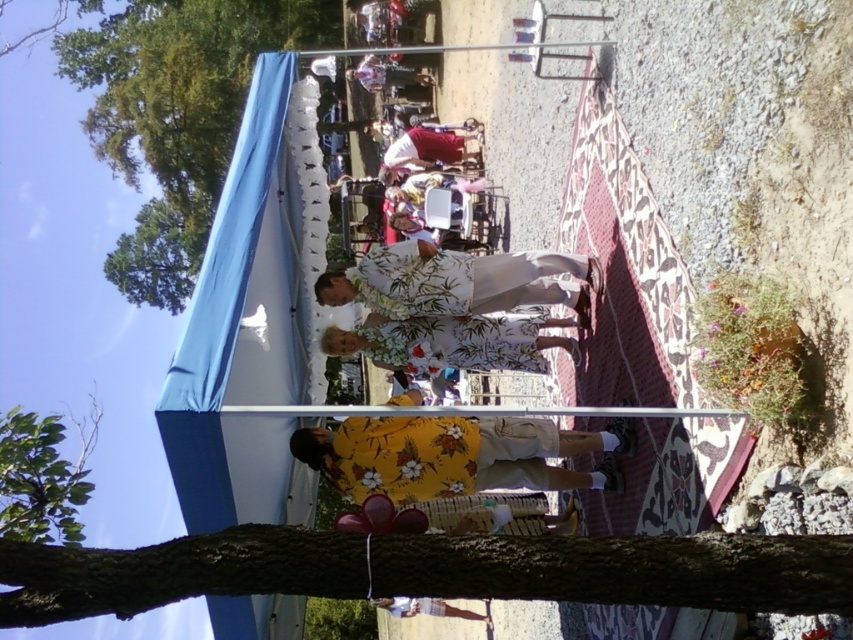
Is floral fabric robe at center to the right of green leafy tree at lower left from the viewer's perspective?

Yes, floral fabric robe at center is to the right of green leafy tree at lower left.

In the scene shown: Does floral fabric robe at center appear under green leafy tree at lower left?

No.

Is point (378, 252) positioned after point (16, 435)?

Yes, point (378, 252) is behind point (16, 435).

The image size is (853, 640). I want to click on floral fabric robe at center, so click(x=461, y=280).

Where is `brown rough bark at lower center`? Image resolution: width=853 pixels, height=640 pixels. brown rough bark at lower center is located at coordinates (428, 570).

Does brown rough bark at lower center come behind floral fabric robe at center?

No, brown rough bark at lower center is in front of floral fabric robe at center.

Who is more forward, (541, 556) or (412, 262)?

Point (541, 556)

Image resolution: width=853 pixels, height=640 pixels. What are the coordinates of `brown rough bark at lower center` in the screenshot? It's located at (428, 570).

Between green leafy tree at upper left and white floral dress at center, which one has more height?

Standing taller between the two is green leafy tree at upper left.

Is green leafy tree at upper left to the left of white floral dress at center from the viewer's perspective?

Correct, you'll find green leafy tree at upper left to the left of white floral dress at center.

Does point (177, 198) come in front of point (410, 346)?

No, it is not.

Find the location of a particular element. This screenshot has height=640, width=853. green leafy tree at upper left is located at coordinates (177, 115).